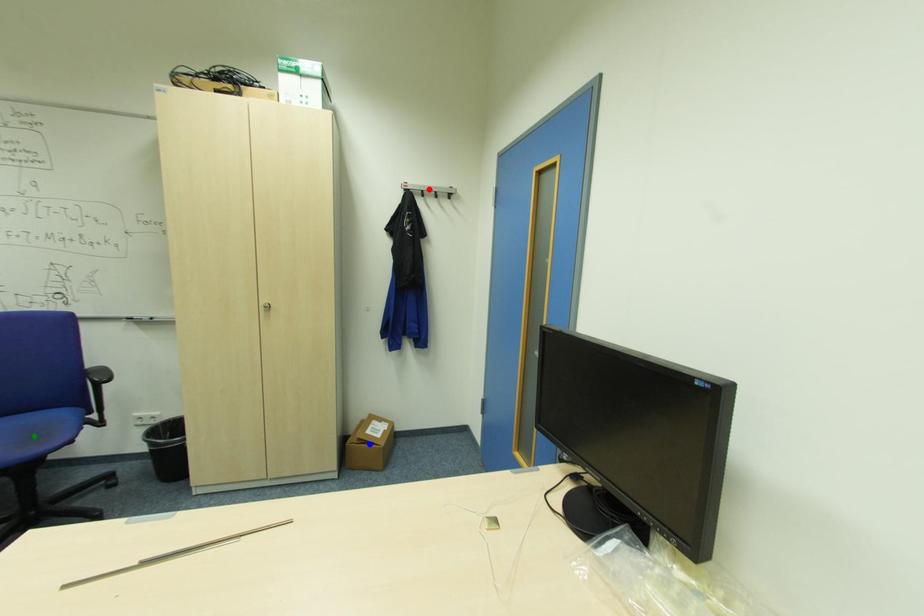
Order these from farthest to nearest:
blue point
green point
red point

red point → blue point → green point